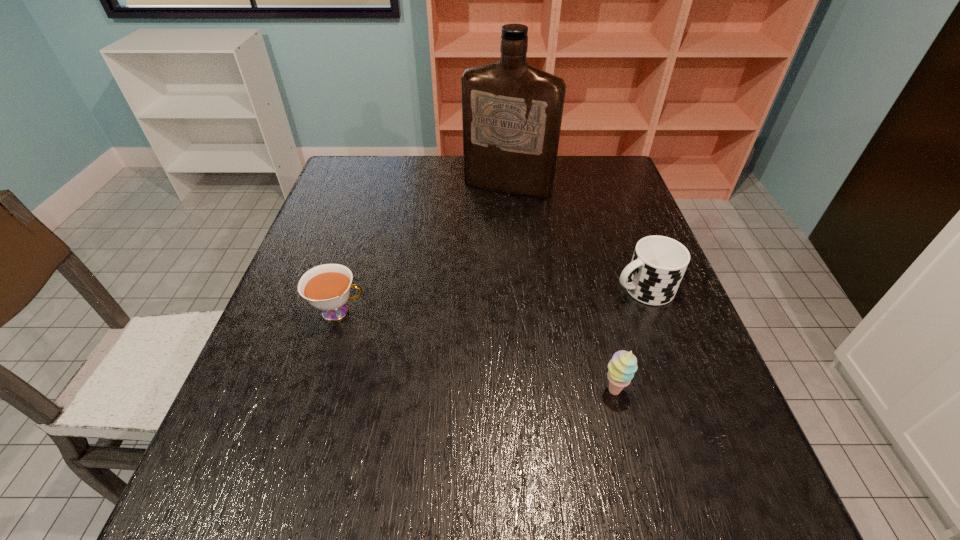
Locate an element on the screen. This screenshot has height=540, width=960. teacup is located at coordinates (326, 287).

You are a GUI agent. You are given a task and a screenshot of the screen. Output one action in this format:
    pyautogui.click(x=<x>, y=<y>)
    Task: Click on the leftmost object
    This screenshot has width=960, height=540.
    Given the screenshot: What is the action you would take?
    pyautogui.click(x=326, y=287)

Identify the location of the nearest object. click(621, 368).

Find the location of a particular element. the second object from right to left is located at coordinates (621, 368).

Find the location of `the rightmost object`. the rightmost object is located at coordinates (658, 264).

The width and height of the screenshot is (960, 540). In order to click on the tallest object in this screenshot , I will do `click(512, 112)`.

Locate an element on the screen. the second object from left to right is located at coordinates (512, 112).

Locate an element on the screen. blank space located 0.240m on the side of the leftmost object with the handle is located at coordinates (475, 312).

You are a GUI agent. You are given a task and a screenshot of the screen. Output one action in this format:
    pyautogui.click(x=<x>, y=<y>)
    Task: Click on the vacant space situated on the left of the nearest object
    The image size is (960, 540).
    Given the screenshot: What is the action you would take?
    pyautogui.click(x=431, y=390)

Identify the location of vacant point located on the side of the rightmost object with the handle. This screenshot has width=960, height=540. (551, 318).